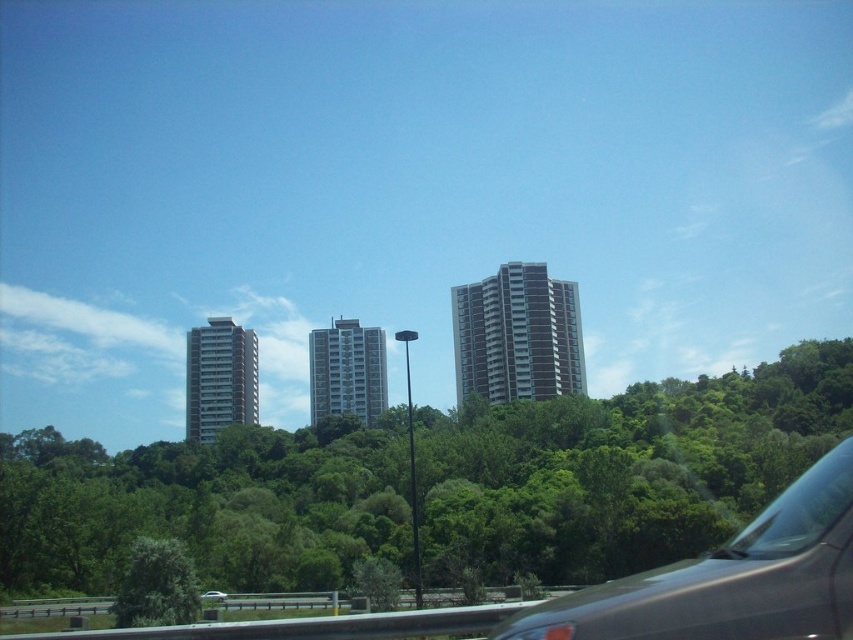
Does glassy gray building at center have a larger size compared to green leafy tree at lower left?

Indeed, glassy gray building at center has a larger size compared to green leafy tree at lower left.

Is glassy gray building at center shorter than green leafy tree at lower left?

No, glassy gray building at center is not shorter than green leafy tree at lower left.

At what (x,y) coordinates should I click in order to perform the action: click on glassy gray building at center. Please return your answer as a coordinate pair (x, y). Looking at the image, I should click on (517, 336).

Locate an element on the screen. This screenshot has width=853, height=640. glassy gray building at center is located at coordinates (517, 336).

Between glassy gray building at center and transparent glass car window at lower right, which one appears on the right side from the viewer's perspective?

Positioned to the right is glassy gray building at center.

Can you confirm if glassy gray building at center is bigger than transparent glass car window at lower right?

Yes, glassy gray building at center is bigger than transparent glass car window at lower right.

I want to click on glassy gray building at center, so click(517, 336).

Identify the location of glassy gray building at center. (517, 336).

Can you confirm if smooth concrete building at left is positioned to the right of white glossy car at center?

No, smooth concrete building at left is not to the right of white glossy car at center.

Who is more forward, (251, 420) or (215, 596)?

Positioned in front is point (215, 596).

At what (x,y) coordinates should I click in order to perform the action: click on smooth concrete building at left. Please return your answer as a coordinate pair (x, y). This screenshot has height=640, width=853. Looking at the image, I should click on (219, 378).